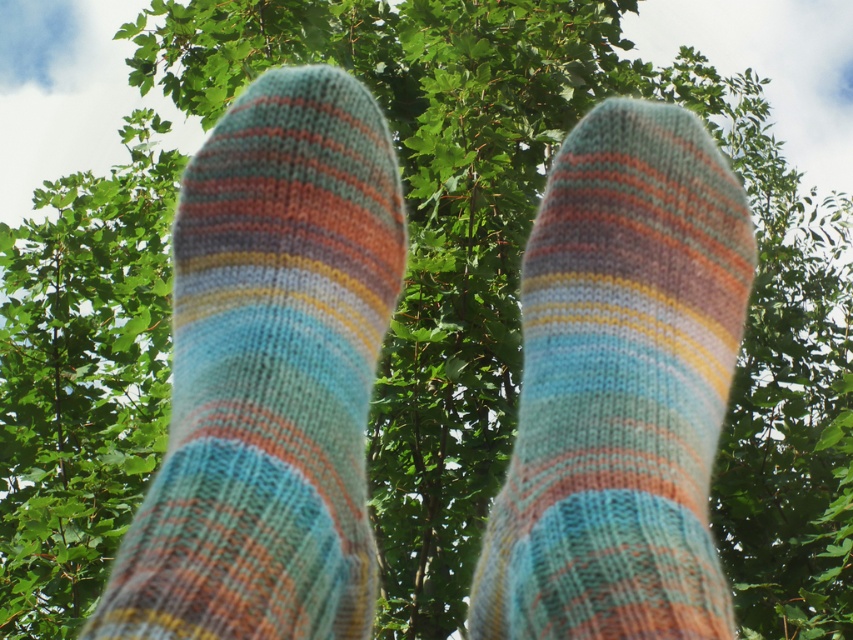
Question: Which point appears farthest from the camera in this image?

Choices:
 (A) (317, 97)
 (B) (515, 458)

Answer: (A)

Question: Does striped woolen sock at center appear under knitted woolen sock at center?

Choices:
 (A) yes
 (B) no

Answer: (B)

Question: Which point appears farthest from the camera in this image?

Choices:
 (A) (233, 282)
 (B) (585, 356)

Answer: (A)

Question: Observing the image, what is the correct spatial positioning of striped woolen sock at center in reference to knitted woolen sock at center?

Choices:
 (A) right
 (B) left

Answer: (B)

Question: Is striped woolen sock at center wider than knitted woolen sock at center?

Choices:
 (A) no
 (B) yes

Answer: (A)